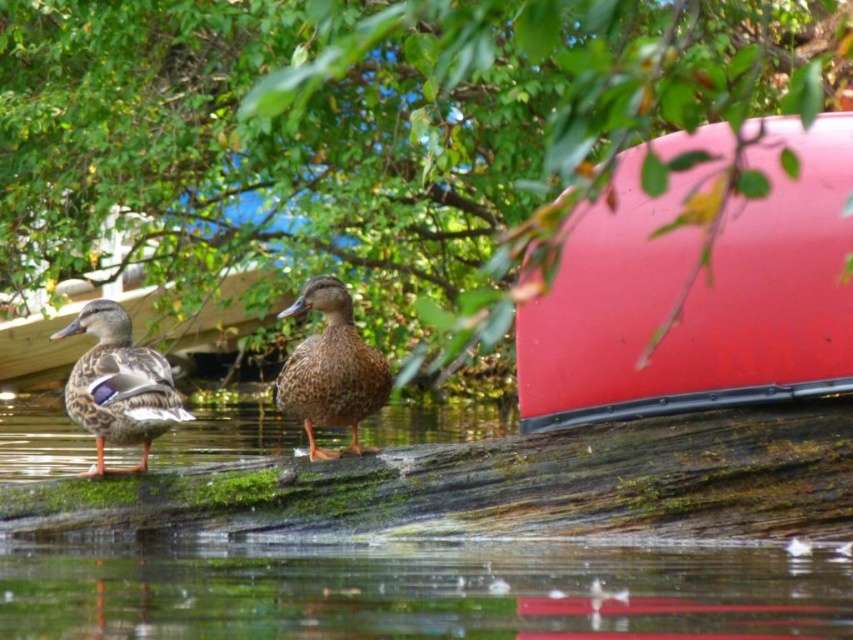
From the picture: You are an observer looking at the scene. You notice the green leafy tree at upper center and the rubberized red canoe at upper right. Which object occupies more horizontal space in the image?

The green leafy tree at upper center might be wider than the rubberized red canoe at upper right, so it likely occupies more horizontal space.

You are standing at the camera position and want to reach the point marked at coordinates point (436, 570). If you have a 4.5 meter long pole, can you reach it with the pole?

The point point (436, 570) is 4.53 meters from camera, so the pole is 0.03 meters shorter than needed. You cannot reach it with the pole.

You are an observer standing at the edge of the water. You see the transparent water at lower center and the brown matte duck at center. Which one appears wider from your viewpoint?

The transparent water at lower center appears wider than the brown matte duck at center because its width surpasses the duck.